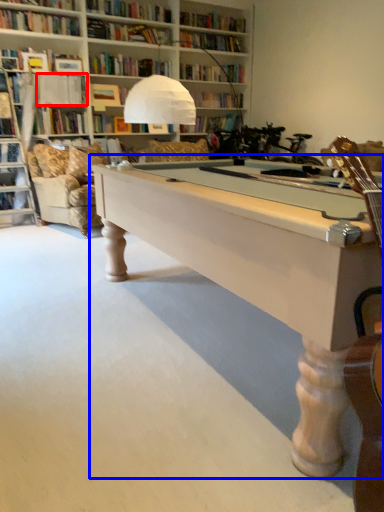
Question: Among these objects, which one is nearest to the camera, book (highlighted by a red box) or table (highlighted by a blue box)?

Choices:
 (A) book
 (B) table

Answer: (B)